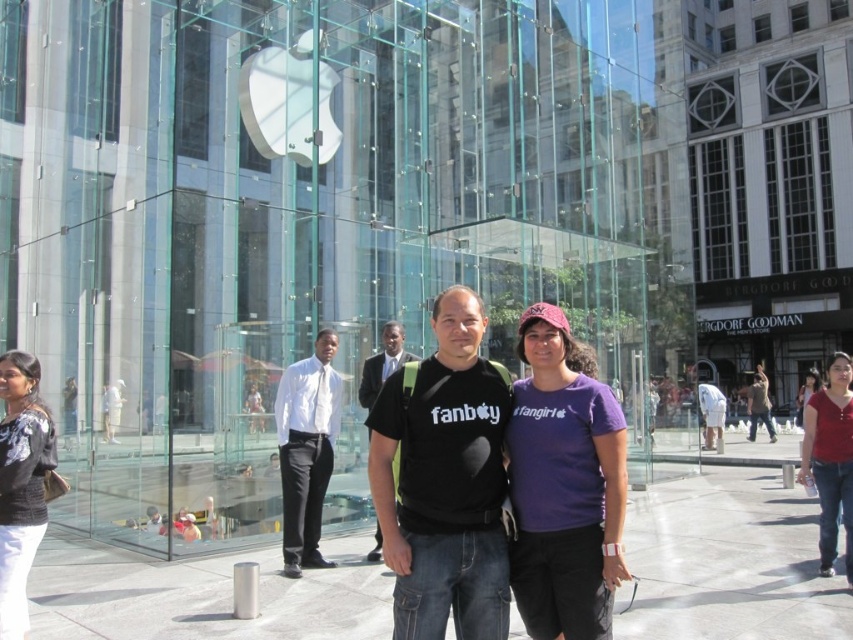
Does purple cotton t-shirt at center have a greater height compared to brown leather jacket at center?

Yes.

Can you confirm if purple cotton t-shirt at center is positioned above brown leather jacket at center?

Correct, purple cotton t-shirt at center is located above brown leather jacket at center.

Describe the element at coordinates (564, 486) in the screenshot. I see `purple cotton t-shirt at center` at that location.

What are the coordinates of `purple cotton t-shirt at center` in the screenshot? It's located at (564, 486).

Which is behind, point (453, 397) or point (705, 410)?

The point (705, 410) is behind.

Can you confirm if black matte t-shirt at center is bigger than white cotton shirt at center?

No, black matte t-shirt at center is not bigger than white cotton shirt at center.

Is point (418, 464) positioned behind point (701, 388)?

No.

The image size is (853, 640). I want to click on black matte t-shirt at center, so click(x=444, y=483).

Between white glossy shirt at center and matte red shirt at center, which one appears on the right side from the viewer's perspective?

matte red shirt at center

You are a GUI agent. You are given a task and a screenshot of the screen. Output one action in this format:
    pyautogui.click(x=<x>, y=<y>)
    Task: Click on the white glossy shirt at center
    
    Given the screenshot: What is the action you would take?
    pyautogui.click(x=306, y=449)